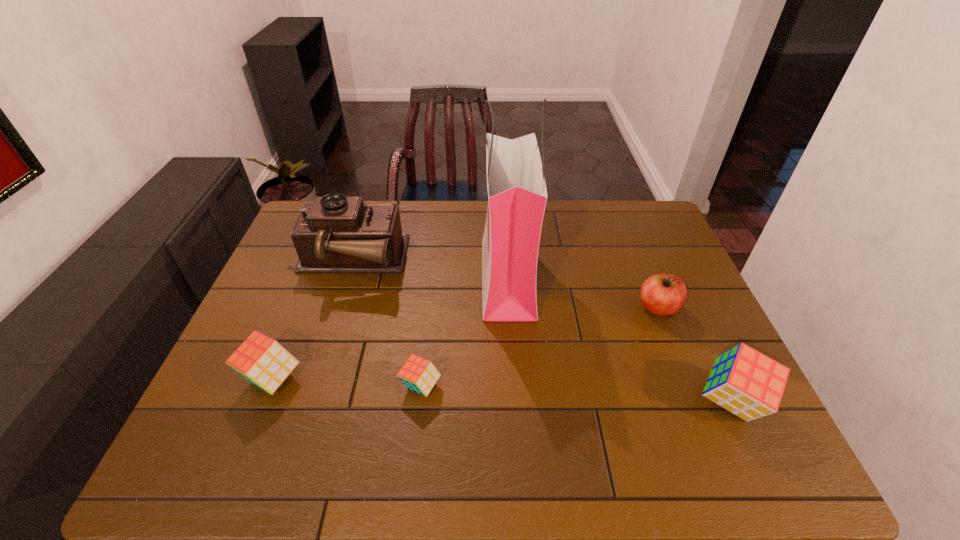
I want to click on blank space located on the back of the rightmost cube, so click(695, 324).

Locate an element on the screen. Image resolution: width=960 pixels, height=540 pixels. vacant space located 0.280m on the front-facing side of the tallest object is located at coordinates (390, 278).

The width and height of the screenshot is (960, 540). Identify the location of vacant space situated 0.190m on the front-facing side of the tallest object. (420, 278).

Image resolution: width=960 pixels, height=540 pixels. I want to click on free location located 0.100m on the front-facing side of the tallest object, so click(x=449, y=278).

Identify the location of vacant region located 0.170m on the front of the apple. The width and height of the screenshot is (960, 540). (685, 375).

At what (x,y) coordinates should I click in order to perform the action: click on vacant region located on the horn of the fifth shortest object. Please return your answer as a coordinate pair (x, y). The image size is (960, 540). Looking at the image, I should click on (468, 261).

This screenshot has height=540, width=960. In order to click on shopping bag positioned at the far edge in this screenshot , I will do `click(517, 195)`.

At what (x,y) coordinates should I click in order to perform the action: click on phonograph_record that is at the far edge. Please return your answer as a coordinate pair (x, y). This screenshot has height=540, width=960. Looking at the image, I should click on (335, 234).

The image size is (960, 540). In order to click on cube that is at the left edge in this screenshot , I will do `click(263, 361)`.

Find the location of a particular element. The height and width of the screenshot is (540, 960). phonograph_record that is positioned at the left edge is located at coordinates click(335, 234).